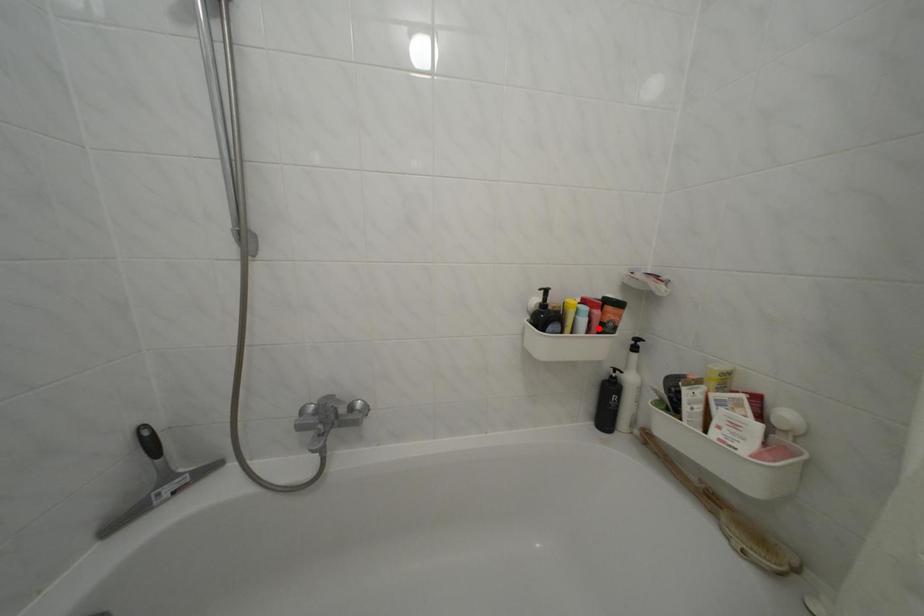
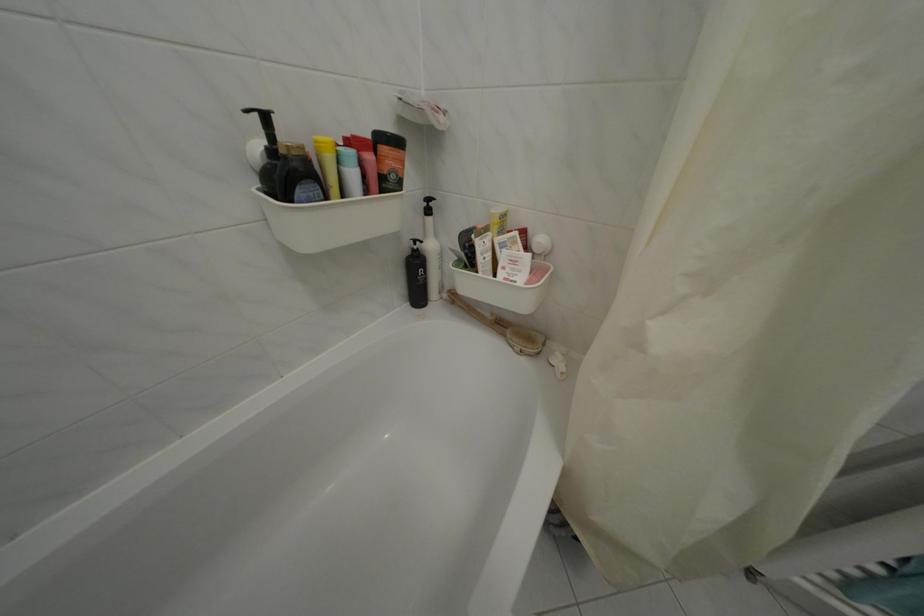
The point at the highlighted location is marked in the first image. Where is the corresponding point in the second image?

(372, 182)